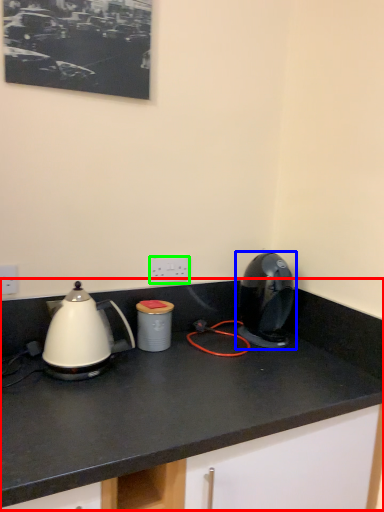
Question: Which object is the closest to the countertop (highlighted by a red box)? Choose among these: home appliance (highlighted by a blue box) or electric outlet (highlighted by a green box).

Choices:
 (A) home appliance
 (B) electric outlet

Answer: (A)